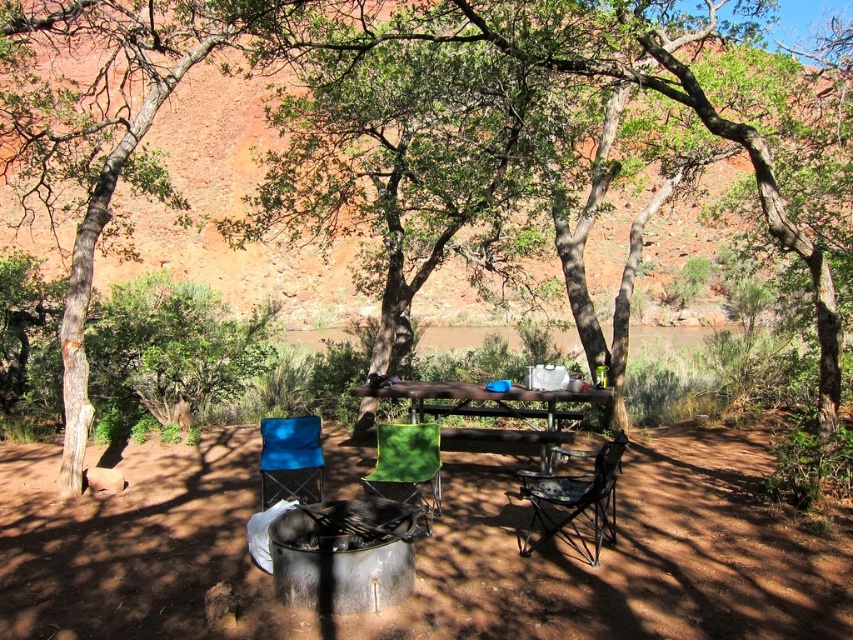
Does green fabric chair at center appear over blue fabric chair at lower left?

No, green fabric chair at center is not above blue fabric chair at lower left.

Measure the distance between green fabric chair at center and blue fabric chair at lower left.

green fabric chair at center and blue fabric chair at lower left are 37.29 inches apart from each other.

Where is `green fabric chair at center`? The width and height of the screenshot is (853, 640). green fabric chair at center is located at coordinates (407, 467).

Image resolution: width=853 pixels, height=640 pixels. Find the location of `green fabric chair at center`. green fabric chair at center is located at coordinates (407, 467).

Can you confirm if camouflage fabric chair at lower right is positioned to the left of green fabric chair at center?

In fact, camouflage fabric chair at lower right is to the right of green fabric chair at center.

Is camouflage fabric chair at lower right wider than green fabric chair at center?

Yes, camouflage fabric chair at lower right is wider than green fabric chair at center.

What do you see at coordinates (575, 497) in the screenshot? The image size is (853, 640). I see `camouflage fabric chair at lower right` at bounding box center [575, 497].

Find the location of a particular element. This screenshot has width=853, height=640. camouflage fabric chair at lower right is located at coordinates (575, 497).

Does wooden picnic table at center appear under blue fabric chair at lower left?

Incorrect, wooden picnic table at center is not positioned below blue fabric chair at lower left.

Can you confirm if wooden picnic table at center is bigger than blue fabric chair at lower left?

Yes, wooden picnic table at center is bigger than blue fabric chair at lower left.

Based on the photo, who is more forward, (544,417) or (291,493)?

Point (291,493) is in front.

Find the location of a particular element. Image resolution: width=853 pixels, height=640 pixels. wooden picnic table at center is located at coordinates (492, 410).